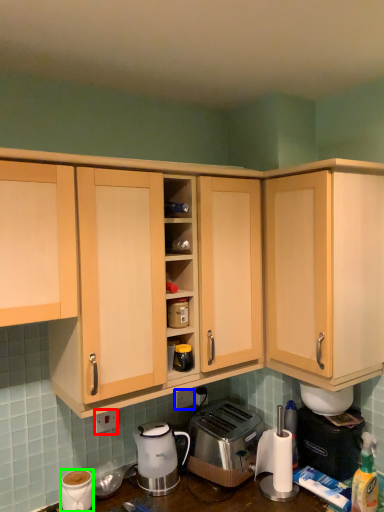
Question: Which object is positioned farthest from electric outlet (highlighted by a red box)? Select from electric outlet (highlighted by a blue box) and coffee cup (highlighted by a green box).

Choices:
 (A) electric outlet
 (B) coffee cup

Answer: (A)